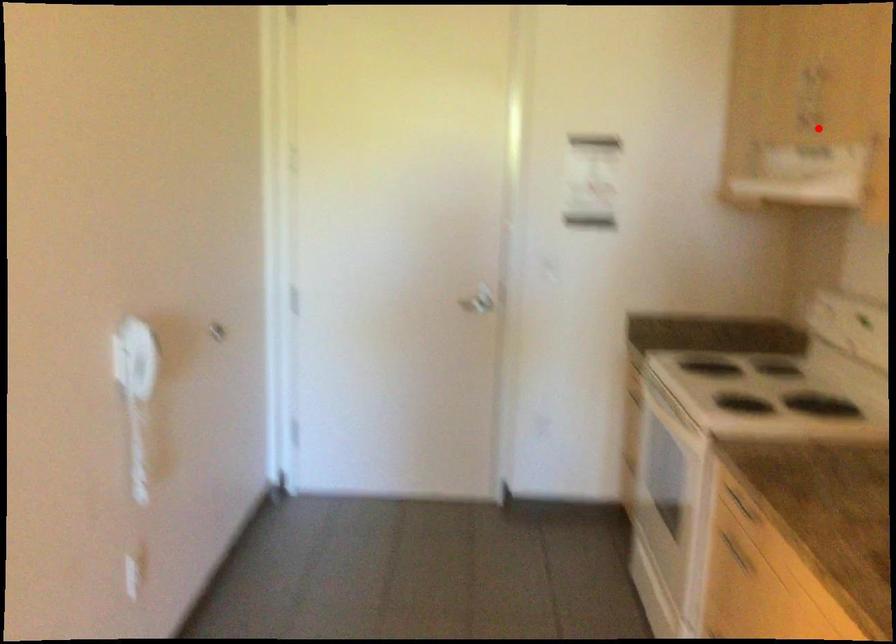
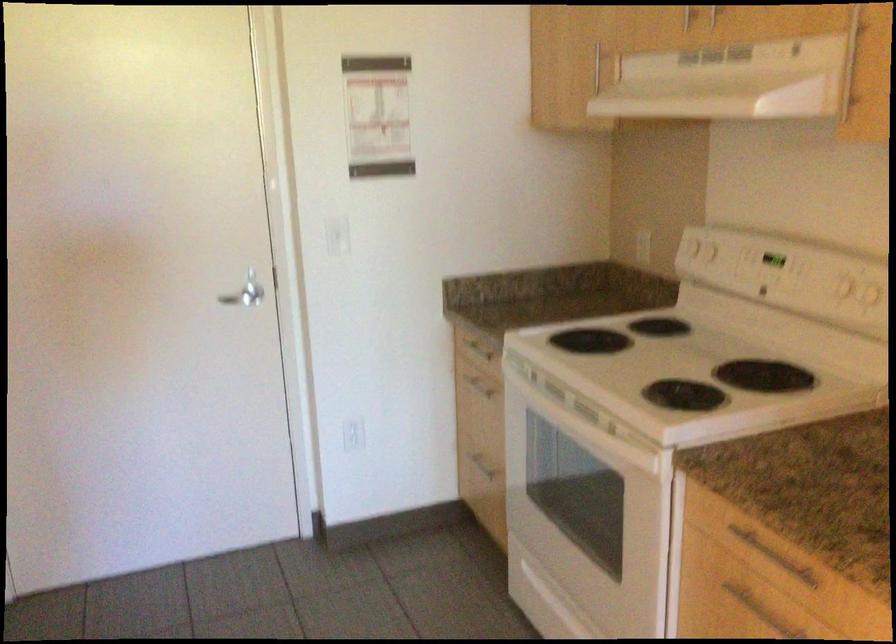
Locate, in the second image, the point that corresponds to the highlighted location in the first image.

(714, 15)